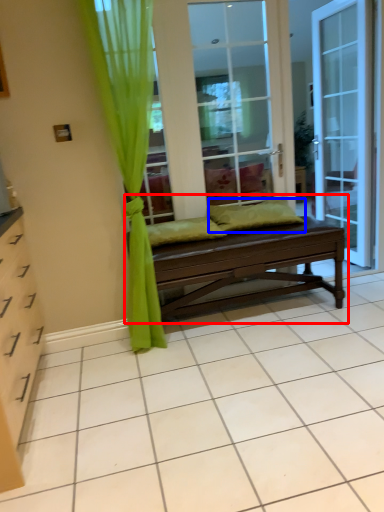
Question: Which object appears closest to the camera in this image, studio couch (highlighted by a red box) or pillow (highlighted by a blue box)?

Choices:
 (A) studio couch
 (B) pillow

Answer: (A)